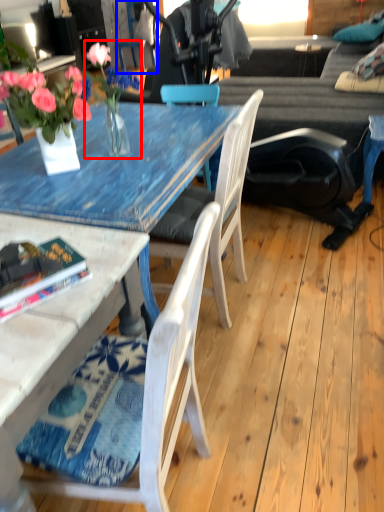
Question: Which object is closer to the camera taking this photo, floral arrangement (highlighted by a red box) or chair (highlighted by a blue box)?

Choices:
 (A) floral arrangement
 (B) chair

Answer: (A)